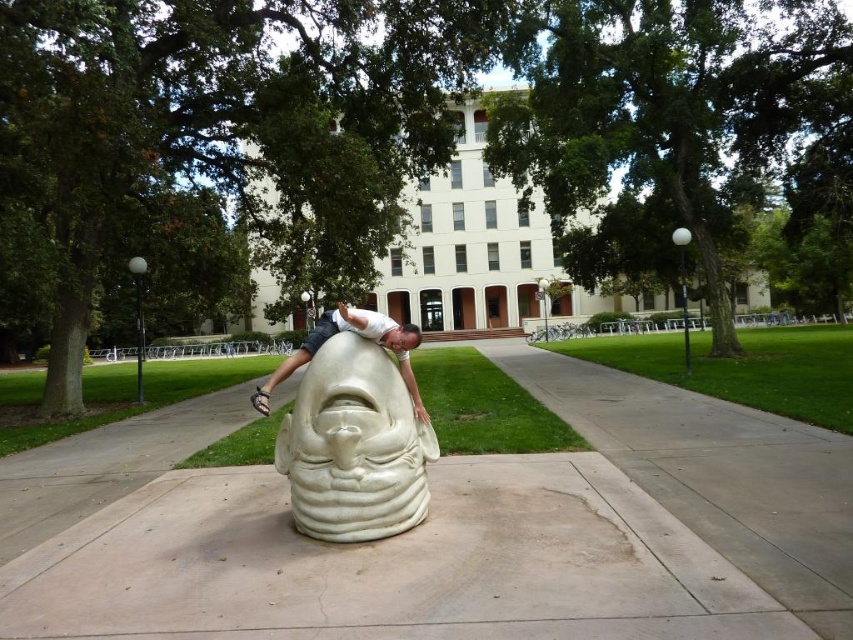
Question: Which point is farther from the camera taking this photo?

Choices:
 (A) (260, 408)
 (B) (309, 372)
 (C) (457, 458)

Answer: (C)

Question: Considering the real-world distances, which object is closest to the white matte sculpture at center?

Choices:
 (A) white marble sculpture at center
 (B) white concrete sculpture at center

Answer: (A)

Question: Can you confirm if white marble sculpture at center is smaller than white matte sculpture at center?

Choices:
 (A) yes
 (B) no

Answer: (A)

Question: Which point is farther from the camera taking this photo?

Choices:
 (A) (33, 632)
 (B) (363, 381)
 (C) (314, 344)

Answer: (C)

Question: Is white marble sculpture at center behind white matte sculpture at center?

Choices:
 (A) yes
 (B) no

Answer: (B)

Question: Can you confirm if white concrete sculpture at center is thinner than white matte sculpture at center?

Choices:
 (A) no
 (B) yes

Answer: (B)